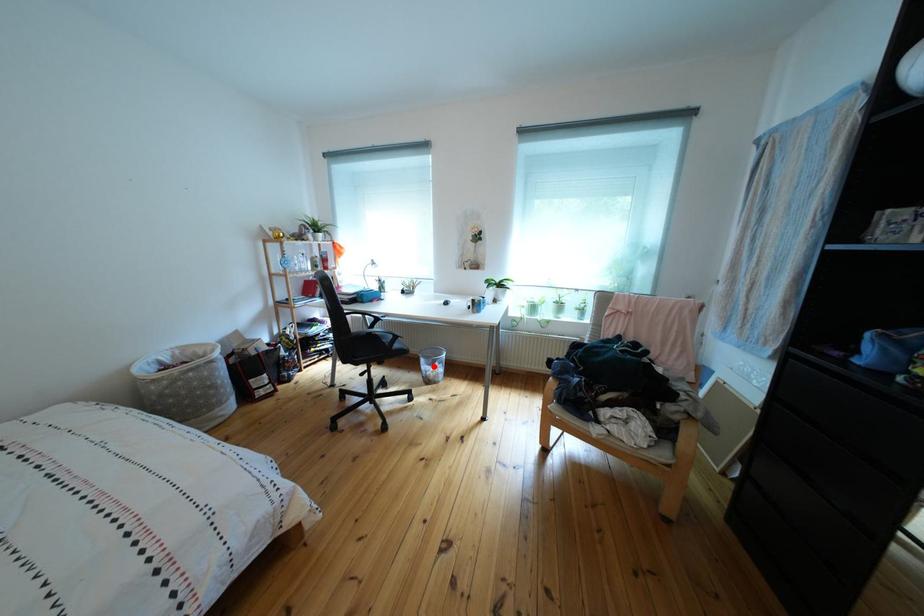
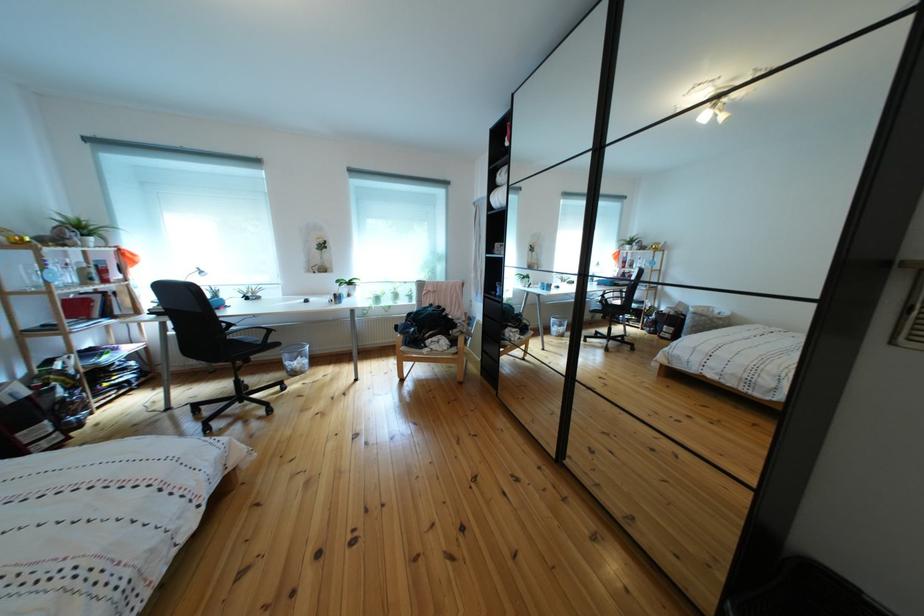
Find the pixel in the second image that matches the highlighted location in the first image.

(297, 362)